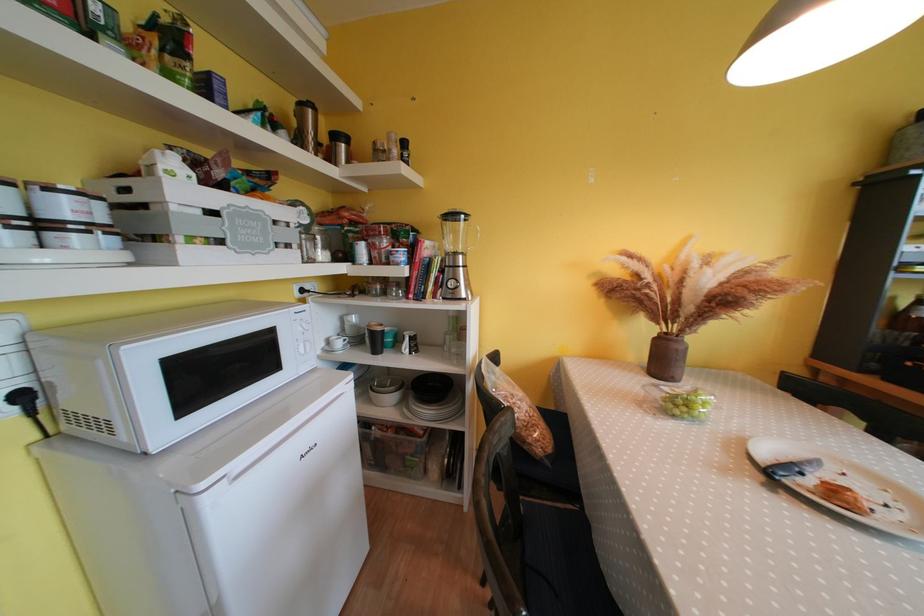
The location [666,358] corresponds to which object?

It corresponds to the brown ceramic vase in the image.